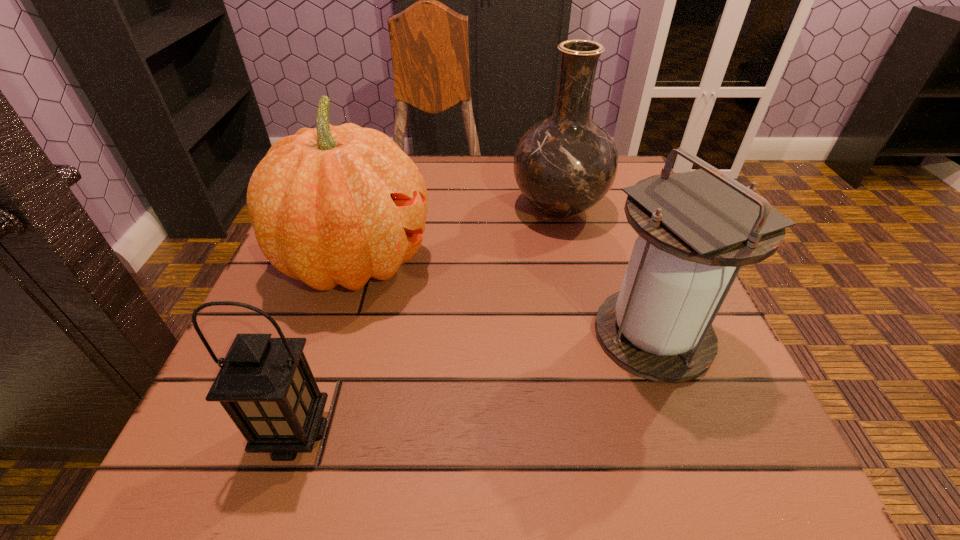
Locate an element on the screen. This screenshot has width=960, height=540. object that is the third closest one to the shorter lantern is located at coordinates point(565,164).

Locate an element on the screen. The width and height of the screenshot is (960, 540). object that is the second closest to the vase is located at coordinates (696, 229).

Where is `vacant space that satisfies the following two spatial constraints: 1. on the back side of the left lantern; 2. on the left side of the right lantern`? This screenshot has height=540, width=960. vacant space that satisfies the following two spatial constraints: 1. on the back side of the left lantern; 2. on the left side of the right lantern is located at coordinates (327, 334).

At what (x,y) coordinates should I click in order to perform the action: click on vacant area that satisfies the following two spatial constraints: 1. on the back side of the farther lantern; 2. on the carved face of the pumpkin. Please return your answer as a coordinate pair (x, y). Looking at the image, I should click on (626, 261).

This screenshot has width=960, height=540. I want to click on vacant position in the image that satisfies the following two spatial constraints: 1. on the back side of the farther lantern; 2. on the carved face of the pumpkin, so click(x=626, y=261).

This screenshot has width=960, height=540. I want to click on vacant space that satisfies the following two spatial constraints: 1. on the back side of the shorter lantern; 2. on the right side of the right lantern, so click(x=327, y=334).

You are a GUI agent. You are given a task and a screenshot of the screen. Output one action in this format:
    pyautogui.click(x=<x>, y=<y>)
    Task: Click on the vacant point that satisfies the following two spatial constraints: 1. on the carved face of the farther lantern; 2. on the left side of the pumpkin
    
    Given the screenshot: What is the action you would take?
    pyautogui.click(x=332, y=334)

Locate an element on the screen. vacant space that satisfies the following two spatial constraints: 1. on the carved face of the pumpkin; 2. on the back side of the farther lantern is located at coordinates (332, 334).

Identify the location of free region that satisfies the following two spatial constraints: 1. on the back side of the shorter lantern; 2. on the left side of the right lantern. This screenshot has width=960, height=540. (327, 334).